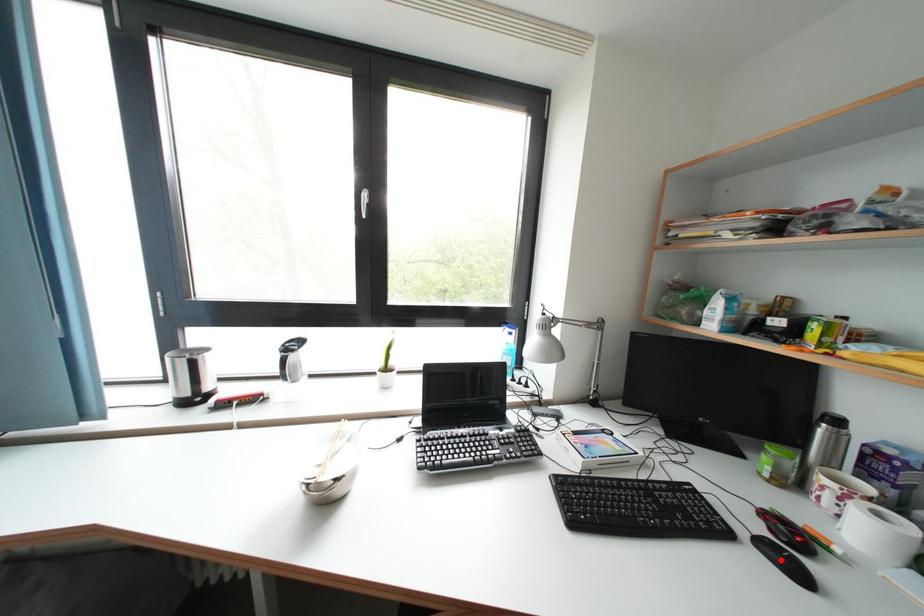
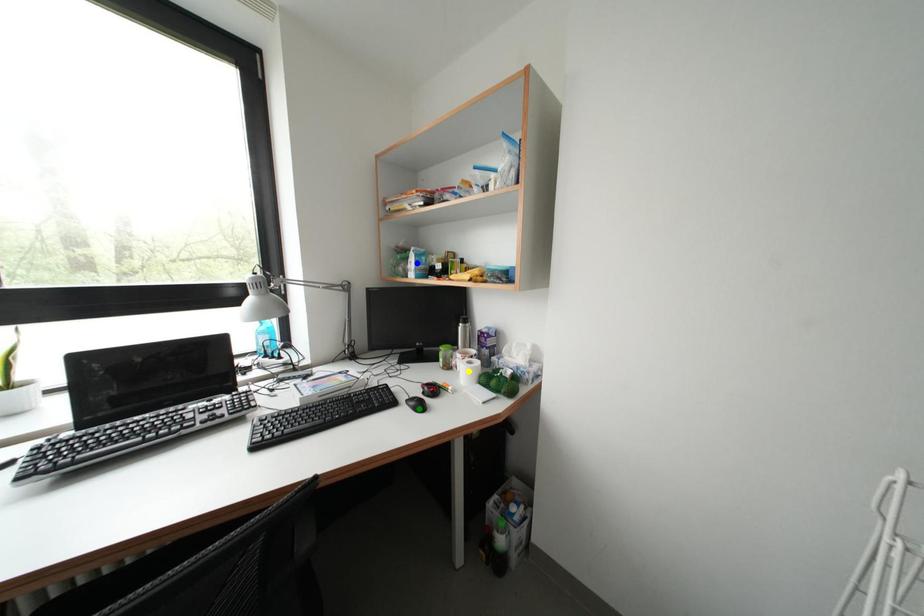
Question: I am providing you with two images of the same scene from different viewpoints. A red point is marked on the first image. You are given multiple points on the second image. Which mark in image 2 goes with the point in image 1?

Choices:
 (A) green point
 (B) yellow point
 (C) blue point

Answer: (A)